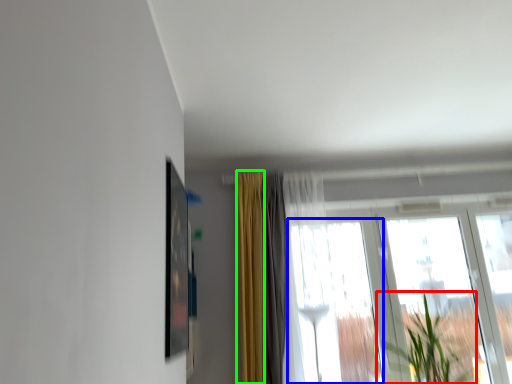
Question: Estimate the real-world distances between objects in this image. Which object is farther from houseplant (highlighted by a red box), window (highlighted by a blue box) or curtain (highlighted by a green box)?

Choices:
 (A) window
 (B) curtain

Answer: (B)